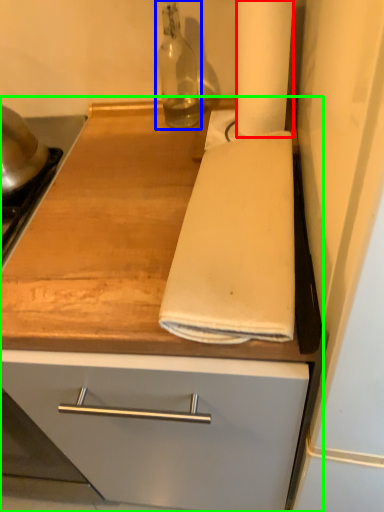
Question: Estimate the real-world distances between objects in this image. Which object is closer to paper towel (highlighted by a red box), bottle (highlighted by a blue box) or countertop (highlighted by a green box)?

Choices:
 (A) bottle
 (B) countertop

Answer: (A)